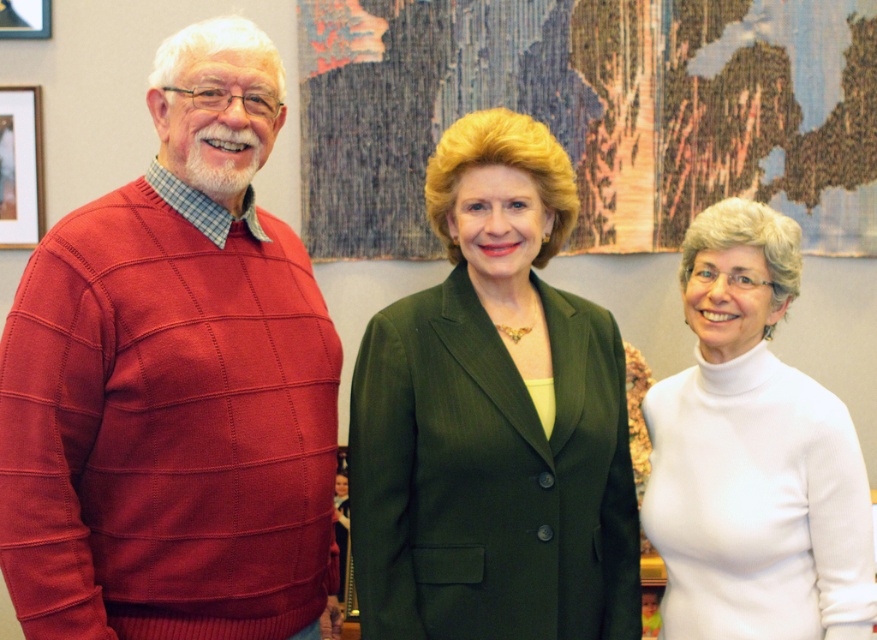
Does white turtleneck sweater at center appear on the right side of brushed metal picture frame at upper left?

Yes, white turtleneck sweater at center is to the right of brushed metal picture frame at upper left.

Who is more distant from viewer, (711,237) or (20,6)?

The point (20,6) is behind.

What are the coordinates of `white turtleneck sweater at center` in the screenshot? It's located at (753, 456).

Consider the image. Is knit sweater at left positioned at the back of white turtleneck sweater at center?

No, it is not.

Which is behind, point (268, 285) or point (703, 442)?

Positioned behind is point (703, 442).

Which is behind, point (279, 321) or point (697, 588)?

Positioned behind is point (697, 588).

Locate an element on the screen. The width and height of the screenshot is (877, 640). knit sweater at left is located at coordinates (175, 385).

Is point (524, 157) positioned behind point (34, 19)?

No, it is in front of (34, 19).

Is green pinstripe suit at center smaller than brushed metal picture frame at upper left?

Incorrect, green pinstripe suit at center is not smaller in size than brushed metal picture frame at upper left.

Between point (548, 637) and point (5, 35), which one is positioned in front?

Positioned in front is point (548, 637).

Locate an element on the screen. green pinstripe suit at center is located at coordinates (493, 419).